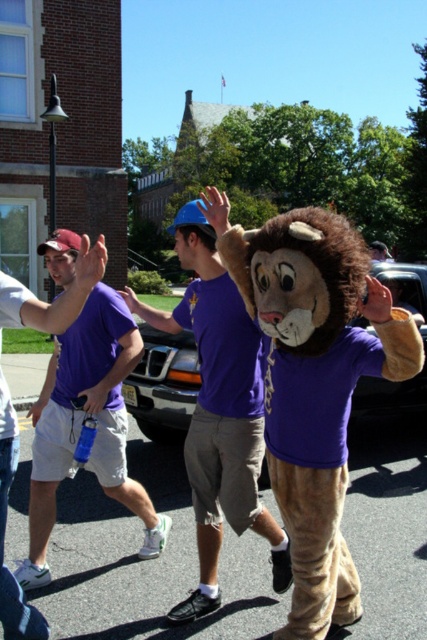
Question: Is fuzzy brown costume at center positioned before purple cotton t-shirt at center?

Choices:
 (A) no
 (B) yes

Answer: (A)

Question: Which object is closer to the camera taking this photo?

Choices:
 (A) matte purple t-shirt at center
 (B) fuzzy brown costume at center
 (C) purple cotton t-shirt at center

Answer: (C)

Question: Which is farther from the fuzzy brown costume at center?

Choices:
 (A) matte purple t-shirt at center
 (B) purple cotton t-shirt at center

Answer: (B)

Question: Can you confirm if fuzzy brown costume at center is positioned below purple cotton t-shirt at center?

Choices:
 (A) no
 (B) yes

Answer: (B)

Question: Which object appears farthest from the camera in this image?

Choices:
 (A) purple cotton t-shirt at center
 (B) fuzzy brown costume at center

Answer: (B)

Question: Is purple cotton t-shirt at center further to the viewer compared to matte purple t-shirt at center?

Choices:
 (A) no
 (B) yes

Answer: (A)